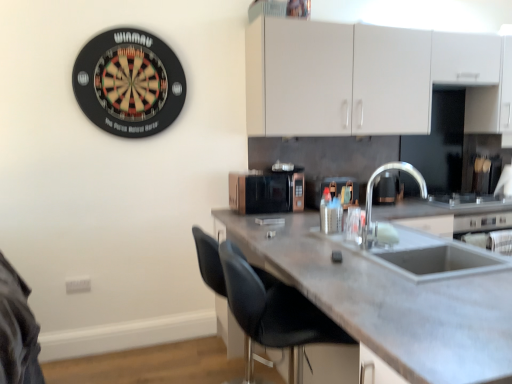
Question: Should I look upward or downward to see rose gold metallic microwave at center, which is the 2th appliance in right-to-left order?

Choices:
 (A) down
 (B) up

Answer: (B)

Question: Is black leather chair at lower center closer to camera compared to satin nickel faucet at sink right?

Choices:
 (A) yes
 (B) no

Answer: (A)

Question: Considering the relative sizes of black leather chair at lower center and satin nickel faucet at sink right in the image provided, is black leather chair at lower center wider than satin nickel faucet at sink right?

Choices:
 (A) no
 (B) yes

Answer: (B)

Question: Could you tell me if black leather chair at lower center is turned towards satin nickel faucet at sink right?

Choices:
 (A) yes
 (B) no

Answer: (A)

Question: From the image's perspective, would you say black leather chair at lower center is shown under satin nickel faucet at sink right?

Choices:
 (A) yes
 (B) no

Answer: (A)

Question: Is black leather chair at lower center looking in the opposite direction of satin nickel faucet at sink right?

Choices:
 (A) yes
 (B) no

Answer: (B)

Question: Considering the relative sizes of black leather chair at lower center and satin nickel faucet at sink right in the image provided, is black leather chair at lower center thinner than satin nickel faucet at sink right?

Choices:
 (A) no
 (B) yes

Answer: (A)

Question: From a real-world perspective, is white matte cabinet at upper center located higher than concrete gray countertop at center?

Choices:
 (A) yes
 (B) no

Answer: (A)

Question: Considering the relative positions of white matte cabinet at upper center and concrete gray countertop at center in the image provided, is white matte cabinet at upper center behind concrete gray countertop at center?

Choices:
 (A) yes
 (B) no

Answer: (A)

Question: Could you tell me if white matte cabinet at upper center is facing concrete gray countertop at center?

Choices:
 (A) yes
 (B) no

Answer: (B)

Question: Considering the relative positions of white matte cabinet at upper center and concrete gray countertop at center in the image provided, is white matte cabinet at upper center to the right of concrete gray countertop at center from the viewer's perspective?

Choices:
 (A) yes
 (B) no

Answer: (A)

Question: Is white matte cabinet at upper center taller than concrete gray countertop at center?

Choices:
 (A) no
 (B) yes

Answer: (A)

Question: Is white matte cabinet at upper center not near concrete gray countertop at center?

Choices:
 (A) yes
 (B) no

Answer: (A)

Question: Can you confirm if metallic silver container at center, positioned as the 1th appliance in right-to-left order, is shorter than rose gold metallic microwave at center, the 1th appliance in the left-to-right sequence?

Choices:
 (A) no
 (B) yes

Answer: (B)